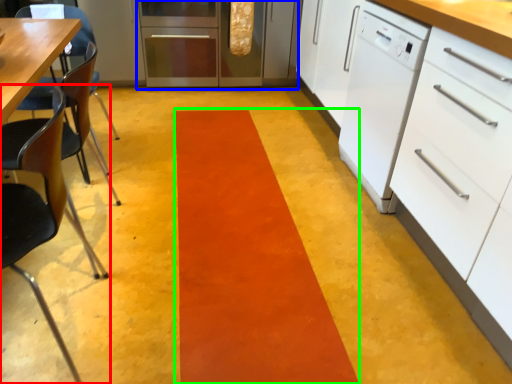
Question: Which object is positioned farthest from chair (highlighted by a red box)? Select from kitchen appliance (highlighted by a blue box) and strip (highlighted by a green box).

Choices:
 (A) kitchen appliance
 (B) strip

Answer: (A)